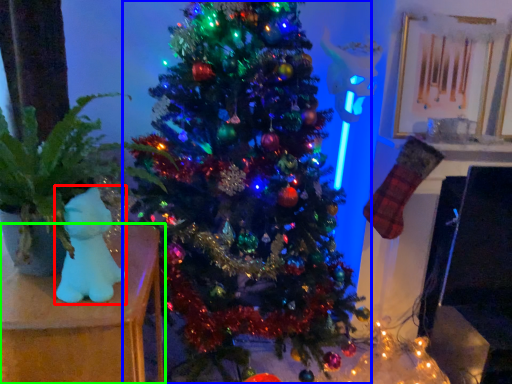
Question: Which is farther away from toy (highlighted by a red box)? christmas tree (highlighted by a blue box) or furniture (highlighted by a green box)?

Choices:
 (A) christmas tree
 (B) furniture

Answer: (A)